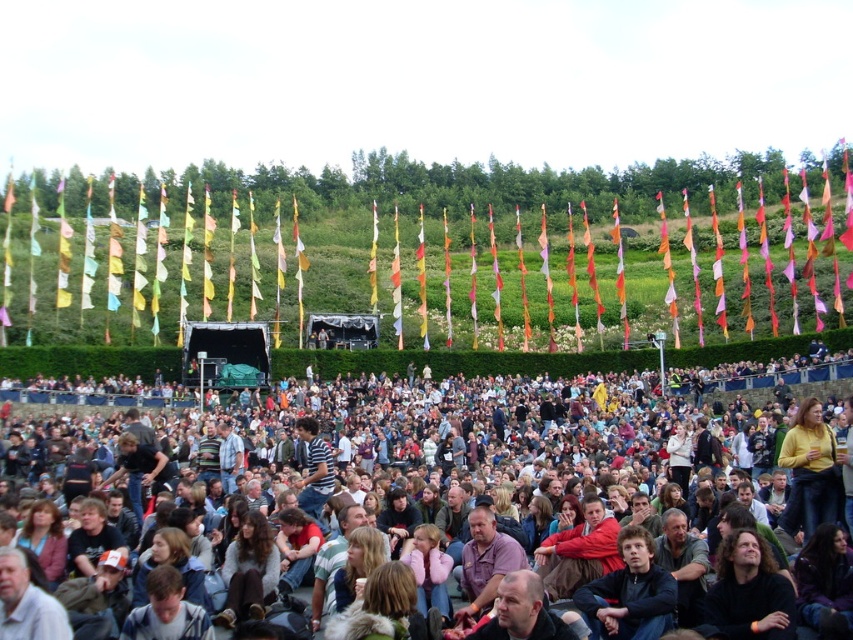
Does multicolored fabric crowd at center appear under dark blue sweater at center?

Actually, multicolored fabric crowd at center is above dark blue sweater at center.

This screenshot has width=853, height=640. Identify the location of multicolored fabric crowd at center. (451, 468).